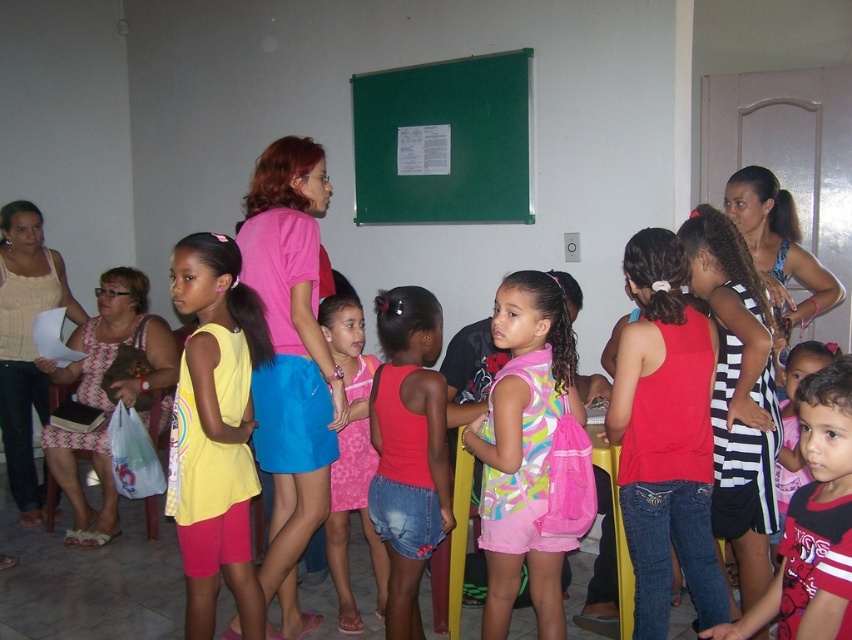
You are a photographer trying to capture a candid shot of the children in the classroom. You notice the pink matte skirt at center and the pink denim shorts at center. Which clothing item is blocking the view of the other?

The pink denim shorts at center is behind the pink matte skirt at center, so the pink matte skirt at center is blocking the view of the pink denim shorts at center.

You are a photographer trying to capture a photo of the children in the classroom. You notice the pink matte skirt at center and the yellow fabric shirt at center. Which clothing item should you focus on if you want to capture the one that is more to the right?

The pink matte skirt at center is positioned on the right side of the yellow fabric shirt at center, so focusing on the pink matte skirt at center would capture the one more to the right.